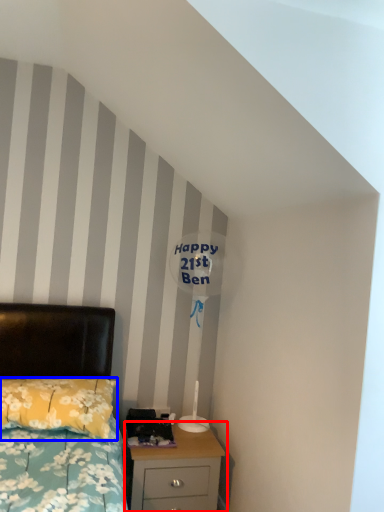
Question: Which object appears closest to the camera in this image, nightstand (highlighted by a red box) or pillow (highlighted by a blue box)?

Choices:
 (A) nightstand
 (B) pillow

Answer: (B)